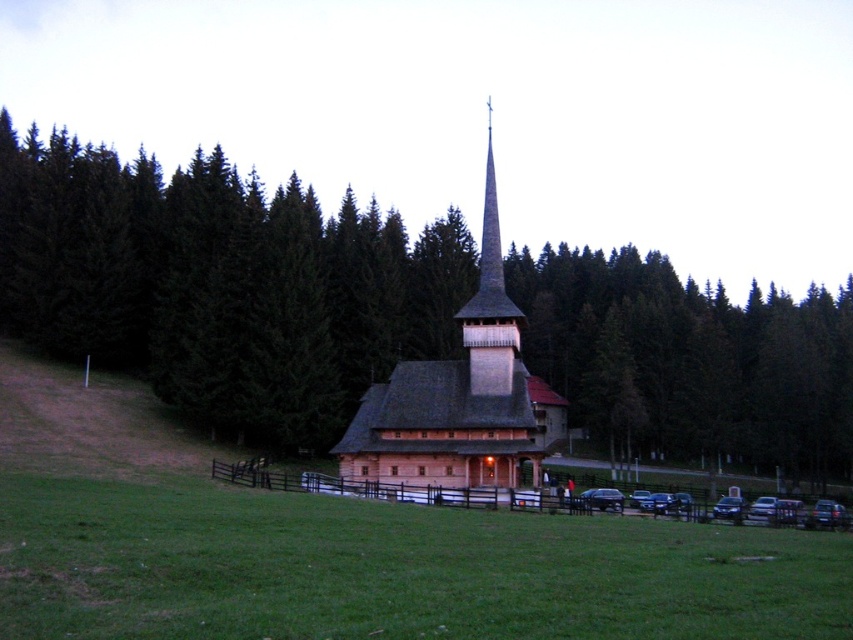
You are a landscape architect planning to install a new pathway between the green grass at lower center and the wooden church at center. Given their relative sizes, which area would require more materials for the pathway construction?

The green grass at lower center has a larger width than the wooden church at center, so constructing a pathway through the green grass at lower center would require more materials due to its greater size.

Consider the image. You are standing in front of the wooden church at center and the wooden spire at center. According to the scene, which object is positioned to the left?

The wooden spire at center is positioned to the left of the wooden church at center.